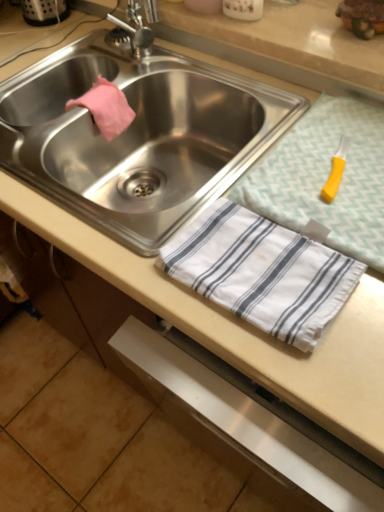
Question: In the image, is stainless steel sink at center positioned in front of or behind yellow plastic knife at upper right?

Choices:
 (A) front
 (B) behind

Answer: (B)

Question: From the image's perspective, is stainless steel sink at center located above or below yellow plastic knife at upper right?

Choices:
 (A) above
 (B) below

Answer: (A)

Question: Visually, is stainless steel sink at center positioned to the left or to the right of yellow plastic knife at upper right?

Choices:
 (A) left
 (B) right

Answer: (A)

Question: Choose the correct answer: Is yellow plastic knife at upper right inside stainless steel sink at center or outside it?

Choices:
 (A) outside
 (B) inside

Answer: (A)

Question: From the image's perspective, is yellow plastic knife at upper right above or below stainless steel sink at center?

Choices:
 (A) below
 (B) above

Answer: (A)

Question: Is point (347, 129) closer or farther from the camera than point (132, 138)?

Choices:
 (A) closer
 (B) farther

Answer: (A)

Question: From a real-world perspective, is yellow plastic knife at upper right above or below stainless steel sink at center?

Choices:
 (A) above
 (B) below

Answer: (A)